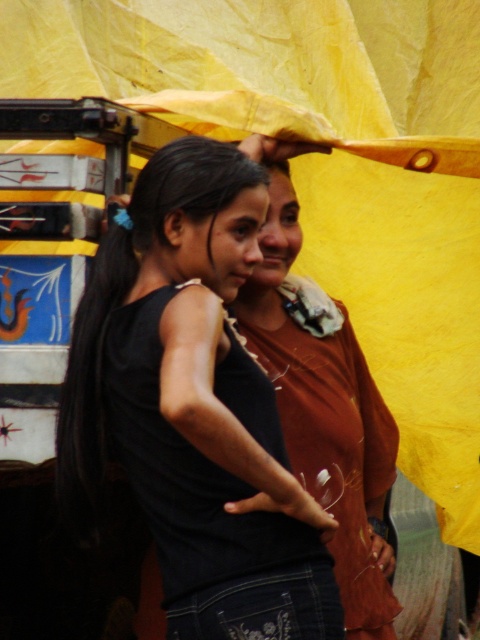
Question: Can you confirm if black matte tank top at center is smaller than matte brown shirt at center?

Choices:
 (A) no
 (B) yes

Answer: (B)

Question: Which object is farther from the camera taking this photo?

Choices:
 (A) black matte tank top at center
 (B) matte brown shirt at center

Answer: (A)

Question: Which object is farther from the camera taking this photo?

Choices:
 (A) black matte tank top at center
 (B) matte brown shirt at center

Answer: (A)

Question: Is black matte tank top at center smaller than matte brown shirt at center?

Choices:
 (A) yes
 (B) no

Answer: (A)

Question: Which point is farther from the camera taking this photo?

Choices:
 (A) (348, 396)
 (B) (264, 428)

Answer: (A)

Question: Observing the image, what is the correct spatial positioning of black matte tank top at center in reference to matte brown shirt at center?

Choices:
 (A) right
 (B) left

Answer: (B)